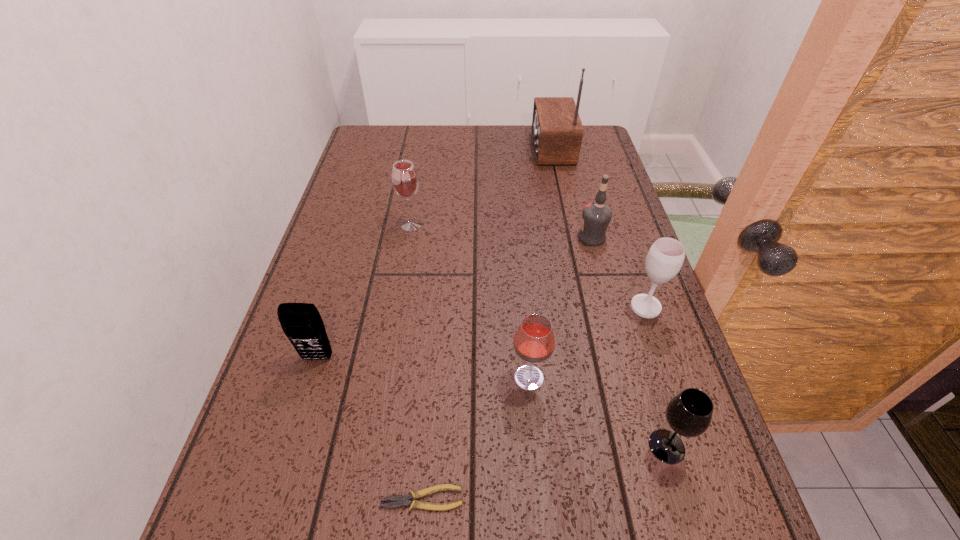
The height and width of the screenshot is (540, 960). Identify the location of vacant space at the right edge of the desktop. (564, 187).

Find the location of a particular element. The width and height of the screenshot is (960, 540). blank space at the far left corner of the desktop is located at coordinates (383, 157).

At what (x,y) coordinates should I click in order to perform the action: click on vacant area that lies between the cellular telephone and the farthest object. Please return your answer as a coordinate pair (x, y). The image size is (960, 540). Looking at the image, I should click on (434, 253).

The height and width of the screenshot is (540, 960). Find the location of `free space between the cellular telephone and the vodka`. free space between the cellular telephone and the vodka is located at coordinates (455, 298).

Where is `vacant area between the radio receiver and the third farthest wineglass`? This screenshot has width=960, height=540. vacant area between the radio receiver and the third farthest wineglass is located at coordinates (540, 263).

Identify the location of free space between the fifth object from right to left and the farthest wineglass. (470, 301).

The width and height of the screenshot is (960, 540). What are the coordinates of `vacant point located between the leftmost wineglass and the fourth object from left to right` in the screenshot? It's located at (470, 301).

Find the location of a particular element. vacant area that lies between the leftmost wineglass and the tallest object is located at coordinates (481, 186).

Locate an element on the screen. free space between the second nearest object and the fifth nearest object is located at coordinates (656, 376).

The height and width of the screenshot is (540, 960). Find the location of `vacant region between the tallest object and the vodka`. vacant region between the tallest object and the vodka is located at coordinates (571, 193).